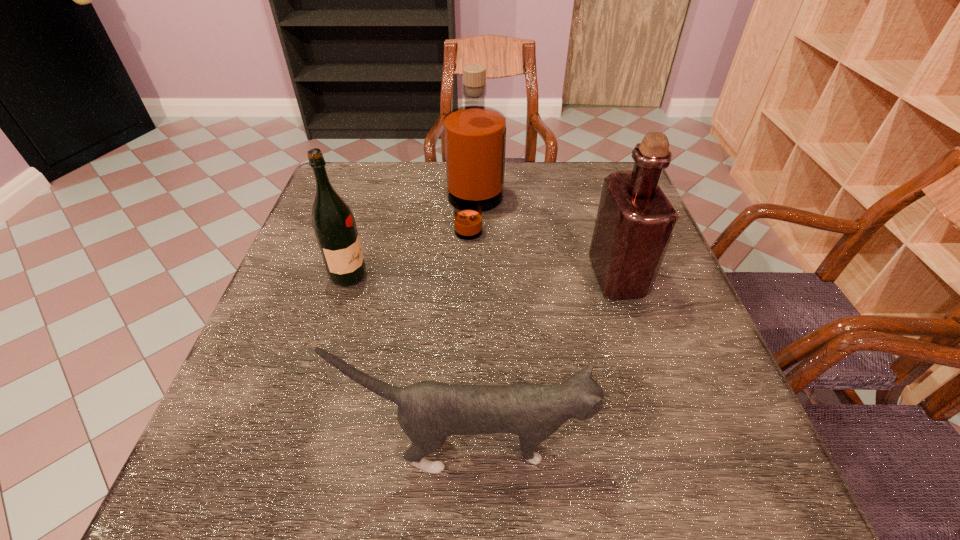
Locate an element on the screen. This screenshot has height=540, width=960. blank region between the nearest object and the rightmost object is located at coordinates (544, 362).

What are the coordinates of `vacant space that is in between the second liquor from right to left and the nearest object` in the screenshot? It's located at pos(473,328).

Locate an element on the screen. The height and width of the screenshot is (540, 960). the second closest object to the second liquor from right to left is located at coordinates (635, 221).

Find the location of a particular element. the second closest object to the cat is located at coordinates (334, 225).

Image resolution: width=960 pixels, height=540 pixels. In order to click on liquor that is the closest one to the cat in this screenshot , I will do `click(635, 221)`.

Where is `liquor that is the nearest to the second liquor from left to right`? liquor that is the nearest to the second liquor from left to right is located at coordinates (334, 225).

At what (x,y) coordinates should I click in order to perform the action: click on free space in the image that satisfies the following two spatial constraints: 1. on the front-facing side of the leftmost object; 2. on the left side of the rightmost liquor. Please return your answer as a coordinate pair (x, y). Image resolution: width=960 pixels, height=540 pixels. Looking at the image, I should click on (348, 277).

Locate an element on the screen. This screenshot has width=960, height=540. free space that satisfies the following two spatial constraints: 1. on the front label of the farthest liquor; 2. on the left side of the rightmost object is located at coordinates (474, 277).

Identify the location of vacant space that satisfies the following two spatial constraints: 1. on the front label of the farthest object; 2. on the back side of the rightmost object. Image resolution: width=960 pixels, height=540 pixels. (474, 277).

Identify the location of vacant area in the image that satisfies the following two spatial constraints: 1. on the front-facing side of the leftmost object; 2. on the right side of the rightmost liquor. (348, 277).